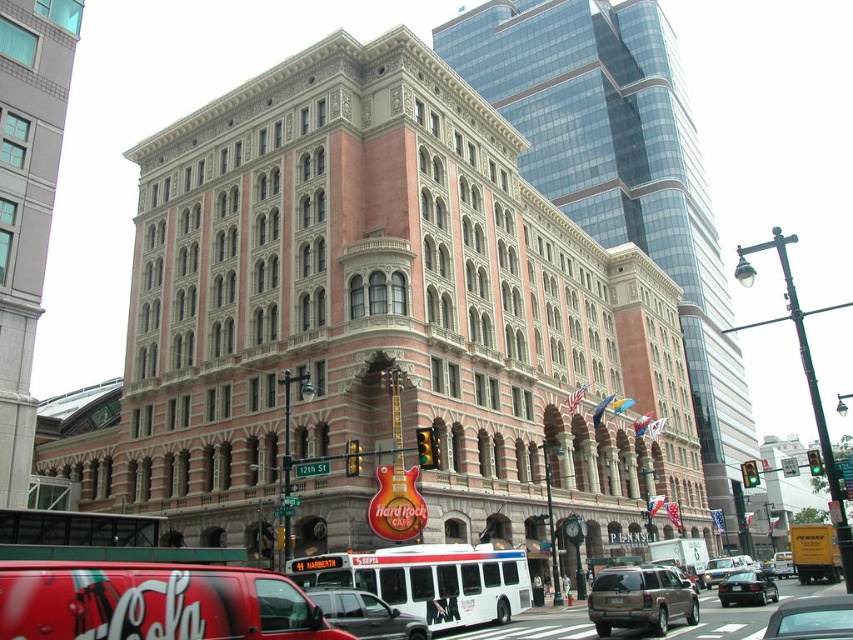
You are a delivery driver who needs to park your vehicle between the metallic silver suv at center and the metallic gray car at center. Your vehicle is 1.8 meters wide. Can you fit your vehicle in the space between them?

The metallic silver suv at center is smaller than the metallic gray car at center, but the exact width of the space between them isn not provided. Without knowing the width of the space, it is impossible to determine if your vehicle will fit.

You are standing on the street looking at the building and the Hard Rock Cafe sign. There are two points marked on the image at coordinates point (329,620) and point (786,620). Which point is closer to you?

Point (329,620) is further to the camera than point (786,620). Therefore, point (786,620) is closer to you.